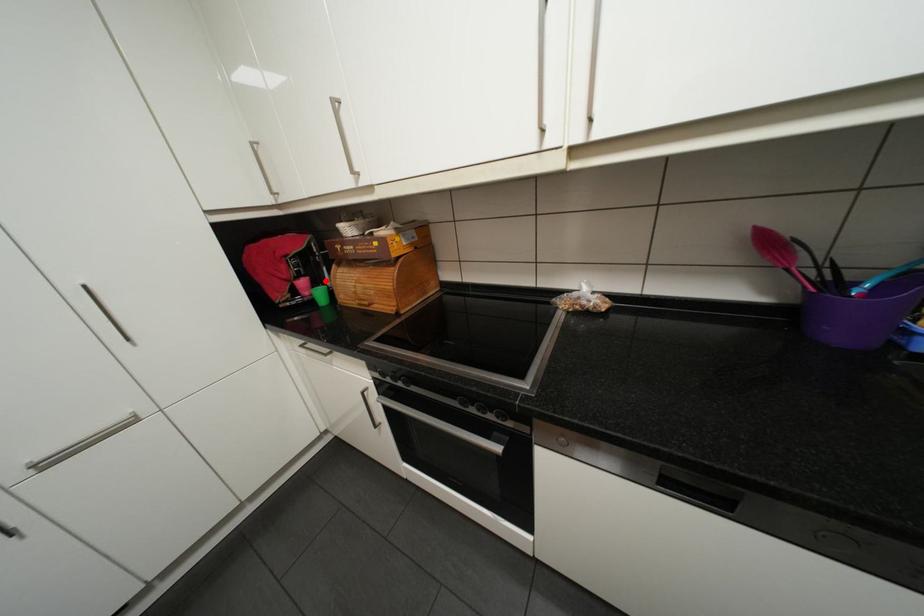
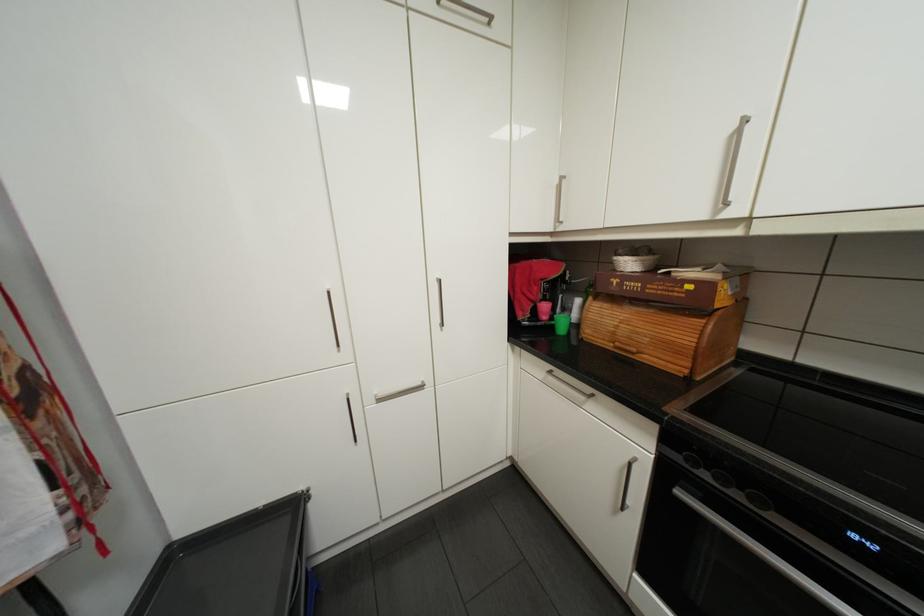
Where in the second image is the point corresponding to the highlighted location from the first image?

(562, 307)